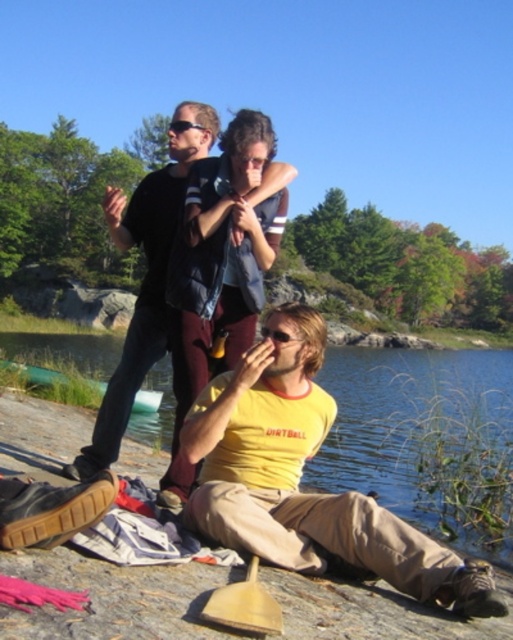
How far apart are yellow cotton shirt at center and dark blue jeans at upper center?

yellow cotton shirt at center and dark blue jeans at upper center are 2.40 meters apart.

Does point (476, 609) come behind point (161, 339)?

No.

Describe the element at coordinates (300, 477) in the screenshot. I see `yellow cotton shirt at center` at that location.

Identify the location of yellow cotton shirt at center. This screenshot has width=513, height=640. tap(300, 477).